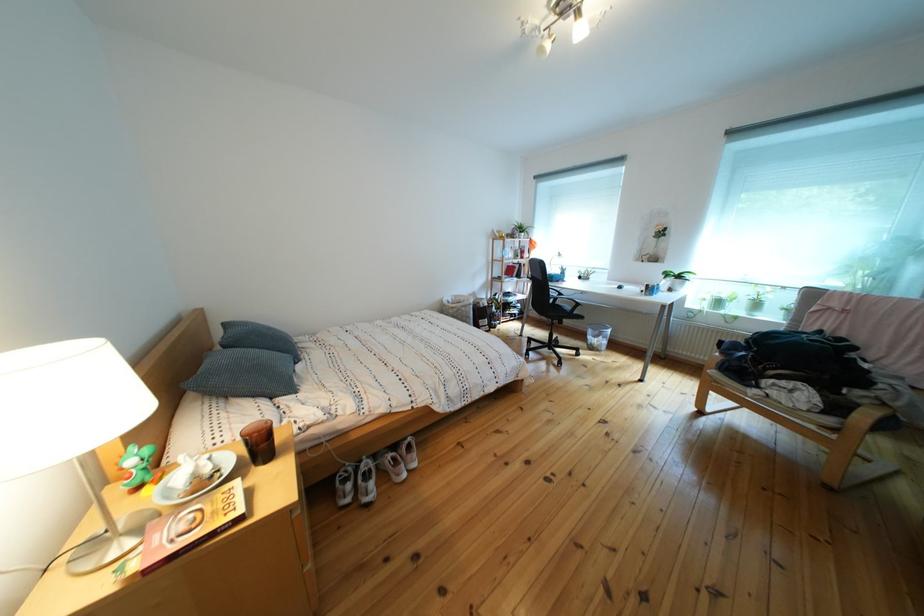
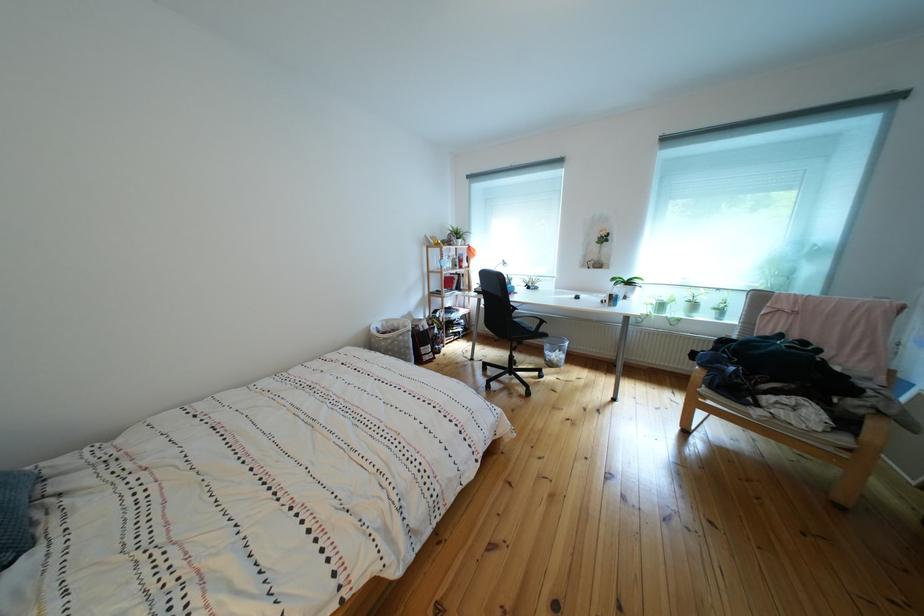
Question: Based on the continuous images, in which direction is the camera rotating? Reply with the corresponding letter.

Choices:
 (A) Left
 (B) Right
 (C) Up
 (D) Down

Answer: (B)